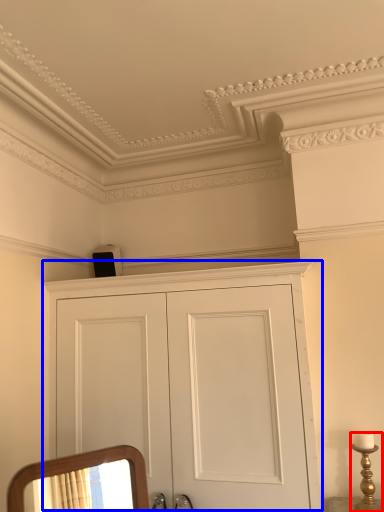
Question: Among these objects, which one is farthest to the camera, candle holder (highlighted by a red box) or cupboard (highlighted by a blue box)?

Choices:
 (A) candle holder
 (B) cupboard

Answer: (A)